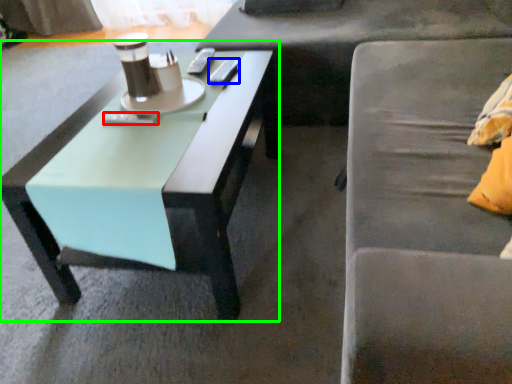
Question: Based on their relative distances, which object is farther from remote control (highlighted by a red box)? Choose from remote control (highlighted by a blue box) and coffee table (highlighted by a green box).

Choices:
 (A) remote control
 (B) coffee table

Answer: (A)